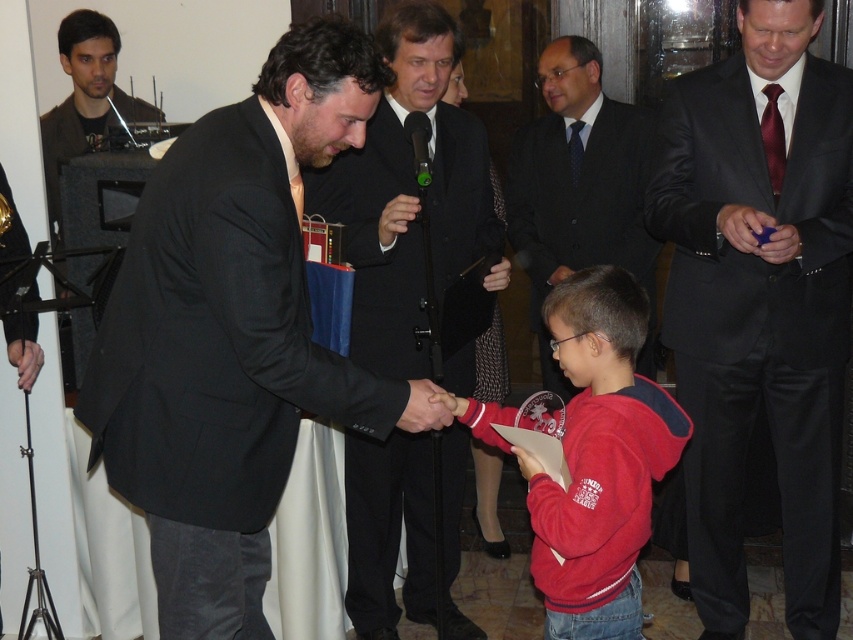
You are planning to place a 1.5 meter long table between the black matte suit at center and the dark suit at center. Will the table fit without overlapping either of them?

The distance between the black matte suit at center and the dark suit at center is 1.59 meters. Since the table is 1.5 meters long, there is enough space to place it between them without overlapping either suit.